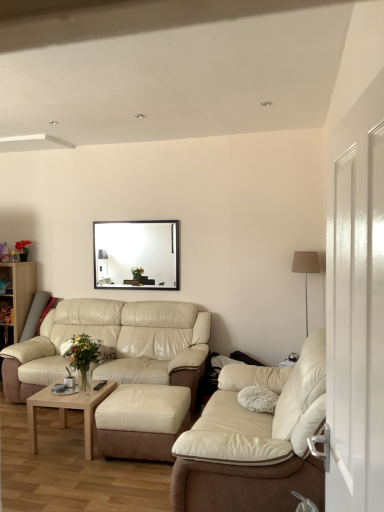
What do you see at coordinates (306, 270) in the screenshot? I see `silver metallic floor lamp at right` at bounding box center [306, 270].

Find the location of a particular element. The height and width of the screenshot is (512, 384). light brown wooden coffee table at lower left is located at coordinates (66, 412).

What do you see at coordinates (111, 344) in the screenshot? I see `beige leather couch at lower left, the first studio couch positioned from the back` at bounding box center [111, 344].

Where is `silver metallic floor lamp at right`? silver metallic floor lamp at right is located at coordinates (306, 270).

Considering the relative sizes of white glossy door at right and light brown wooden coffee table at lower left in the image provided, is white glossy door at right shorter than light brown wooden coffee table at lower left?

In fact, white glossy door at right may be taller than light brown wooden coffee table at lower left.

Considering the positions of point (376, 129) and point (66, 407), is point (376, 129) closer or farther from the camera than point (66, 407)?

Point (376, 129) appears to be closer to the viewer than point (66, 407).

Is white glossy door at right oriented away from light brown wooden coffee table at lower left?

No, white glossy door at right's orientation is not away from light brown wooden coffee table at lower left.

In terms of width, does white glossy door at right look wider or thinner when compared to light brown wooden coffee table at lower left?

Clearly, white glossy door at right has less width compared to light brown wooden coffee table at lower left.

Looking at this image, considering the relative sizes of beige leather couch at center, which ranks as the first studio couch in right-to-left order, and silver metallic floor lamp at right in the image provided, is beige leather couch at center, which ranks as the first studio couch in right-to-left order, wider than silver metallic floor lamp at right?

Indeed, beige leather couch at center, which ranks as the first studio couch in right-to-left order, has a greater width compared to silver metallic floor lamp at right.

From a real-world perspective, is beige leather couch at center, marked as the 2th studio couch in a left-to-right arrangement, positioned over silver metallic floor lamp at right based on gravity?

Actually, beige leather couch at center, marked as the 2th studio couch in a left-to-right arrangement, is physically below silver metallic floor lamp at right in the real world.

How different are the orientations of beige leather couch at center, which ranks as the first studio couch in right-to-left order, and silver metallic floor lamp at right in degrees?

The angle between the facing direction of beige leather couch at center, which ranks as the first studio couch in right-to-left order, and the facing direction of silver metallic floor lamp at right is 91 degrees.

At what (x,y) coordinates should I click in order to perform the action: click on the 2nd studio couch positioned below the silver metallic floor lamp at right (from the image's perspective). Please return your answer as a coordinate pair (x, y). This screenshot has width=384, height=512. Looking at the image, I should click on (247, 451).

From the image's perspective, is suede ottoman at center located beneath light brown wooden coffee table at lower left?

No, from the image's perspective, suede ottoman at center is not beneath light brown wooden coffee table at lower left.

Considering the sizes of objects suede ottoman at center and light brown wooden coffee table at lower left in the image provided, who is bigger, suede ottoman at center or light brown wooden coffee table at lower left?

Bigger between the two is suede ottoman at center.

Can you confirm if suede ottoman at center is shorter than light brown wooden coffee table at lower left?

No, suede ottoman at center is not shorter than light brown wooden coffee table at lower left.

Where is `picture frame behind the silver metallic floor lamp at right`? picture frame behind the silver metallic floor lamp at right is located at coordinates (136, 255).

Based on the photo, would you consider black glossy picture frame at upper center to be distant from silver metallic floor lamp at right?

That's right, there is a large distance between black glossy picture frame at upper center and silver metallic floor lamp at right.

Can you tell me how much black glossy picture frame at upper center and silver metallic floor lamp at right differ in facing direction?

0.996 degrees separate the facing orientations of black glossy picture frame at upper center and silver metallic floor lamp at right.

Could you measure the distance between black glossy picture frame at upper center and silver metallic floor lamp at right?

The distance of black glossy picture frame at upper center from silver metallic floor lamp at right is 1.86 meters.

Based on the photo, from a real-world perspective, which is physically below, white glossy door at right or wooden bookshelf at left?

wooden bookshelf at left, from a real-world perspective.

Is white glossy door at right spatially inside wooden bookshelf at left, or outside of it?

white glossy door at right is located beyond the bounds of wooden bookshelf at left.

Can we say light brown wooden coffee table at lower left lies outside wooden bookshelf at left?

Yes.

Where is `coffee table that is under the wooden bookshelf at left (from a real-world perspective)`? coffee table that is under the wooden bookshelf at left (from a real-world perspective) is located at coordinates (66, 412).

From a real-world perspective, which object stands above the other?

wooden bookshelf at left is physically above.

Does light brown wooden coffee table at lower left have a lesser width compared to wooden bookshelf at left?

No, light brown wooden coffee table at lower left is not thinner than wooden bookshelf at left.

Between point (176, 276) and point (36, 398), which one is positioned behind?

The point (176, 276) is more distant.

What's the angular difference between black glossy picture frame at upper center and light brown wooden coffee table at lower left's facing directions?

The facing directions of black glossy picture frame at upper center and light brown wooden coffee table at lower left are 1.74 degrees apart.

The height and width of the screenshot is (512, 384). I want to click on coffee table that is on the left side of black glossy picture frame at upper center, so (x=66, y=412).

From the image's perspective, which is above, black glossy picture frame at upper center or light brown wooden coffee table at lower left?

black glossy picture frame at upper center, from the image's perspective.

The width and height of the screenshot is (384, 512). I want to click on coffee table below the white glossy door at right (from a real-world perspective), so click(66, 412).

Find the location of a particular element. This screenshot has width=384, height=512. lamp above the beige leather couch at center, which appears as the 2th studio couch when viewed from the back (from the image's perspective) is located at coordinates (306, 270).

Looking at this image, looking at the image, which one is located closer to black glossy picture frame at upper center, silver metallic floor lamp at right or wooden bookshelf at left?

wooden bookshelf at left is positioned closer to the anchor black glossy picture frame at upper center.

Estimate the real-world distances between objects in this image. Which object is closer to suede ottoman at center, black glossy picture frame at upper center or wooden bookshelf at left?

black glossy picture frame at upper center lies closer to suede ottoman at center than the other object.

From the picture: From the image, which object appears to be farther from white glossy door at right, beige leather couch at lower left, marked as the first studio couch in a left-to-right arrangement, or black glossy picture frame at upper center?

black glossy picture frame at upper center is further to white glossy door at right.

When comparing their distances from black glossy picture frame at upper center, does wooden bookshelf at left or beige leather couch at center, which appears as the 2th studio couch when viewed from the back, seem further?

The object further to black glossy picture frame at upper center is beige leather couch at center, which appears as the 2th studio couch when viewed from the back.

From the image, which object appears to be farther from silver metallic floor lamp at right, beige leather couch at center, which is the 1th studio couch from front to back, or suede ottoman at center?

suede ottoman at center.

When comparing their distances from silver metallic floor lamp at right, does light brown wooden coffee table at lower left or wooden bookshelf at left seem further?

Among the two, wooden bookshelf at left is located further to silver metallic floor lamp at right.

Which object lies further to the anchor point wooden bookshelf at left, beige leather couch at center, which ranks as the first studio couch in right-to-left order, or beige leather couch at lower left, positioned as the 2th studio couch in front-to-back order?

The object further to wooden bookshelf at left is beige leather couch at center, which ranks as the first studio couch in right-to-left order.

Considering their positions, is beige leather couch at lower left, marked as the first studio couch in a left-to-right arrangement, positioned further to suede ottoman at center than wooden bookshelf at left?

Among the two, wooden bookshelf at left is located further to suede ottoman at center.

Locate an element on the screen. studio couch between light brown wooden coffee table at lower left and black glossy picture frame at upper center from front to back is located at coordinates (111, 344).

This screenshot has height=512, width=384. I want to click on footrest between beige leather couch at center, which appears as the 2th studio couch when viewed from the back, and black glossy picture frame at upper center, along the z-axis, so click(x=142, y=421).

This screenshot has height=512, width=384. I want to click on coffee table located between suede ottoman at center and beige leather couch at lower left, positioned as the 2th studio couch in front-to-back order, in the depth direction, so click(66, 412).

Find the location of `footrest between white glossy door at right and silver metallic floor lamp at right from front to back`. footrest between white glossy door at right and silver metallic floor lamp at right from front to back is located at coordinates (142, 421).